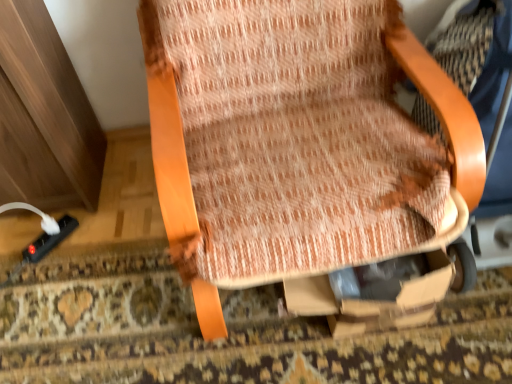
Question: From a real-world perspective, is black plastic plug at lower left positioned over textured fabric chair at center based on gravity?

Choices:
 (A) yes
 (B) no

Answer: (B)

Question: Considering the relative sizes of black plastic plug at lower left and textured fabric chair at center in the image provided, is black plastic plug at lower left thinner than textured fabric chair at center?

Choices:
 (A) yes
 (B) no

Answer: (A)

Question: Is black plastic plug at lower left to the left of textured fabric chair at center from the viewer's perspective?

Choices:
 (A) no
 (B) yes

Answer: (B)

Question: Is black plastic plug at lower left turned away from textured fabric chair at center?

Choices:
 (A) no
 (B) yes

Answer: (A)

Question: Can you confirm if black plastic plug at lower left is wider than textured fabric chair at center?

Choices:
 (A) yes
 (B) no

Answer: (B)

Question: From the image's perspective, is black plastic plug at lower left located beneath textured fabric chair at center?

Choices:
 (A) yes
 (B) no

Answer: (A)

Question: Considering the relative sizes of textured fabric chair at center and black plastic plug at lower left in the image provided, is textured fabric chair at center thinner than black plastic plug at lower left?

Choices:
 (A) no
 (B) yes

Answer: (A)

Question: From a real-world perspective, is textured fabric chair at center physically above black plastic plug at lower left?

Choices:
 (A) yes
 (B) no

Answer: (A)

Question: Considering the relative positions of textured fabric chair at center and black plastic plug at lower left in the image provided, is textured fabric chair at center to the right of black plastic plug at lower left from the viewer's perspective?

Choices:
 (A) no
 (B) yes

Answer: (B)

Question: Considering the relative sizes of textured fabric chair at center and black plastic plug at lower left in the image provided, is textured fabric chair at center shorter than black plastic plug at lower left?

Choices:
 (A) no
 (B) yes

Answer: (A)

Question: From a real-world perspective, is textured fabric chair at center below black plastic plug at lower left?

Choices:
 (A) no
 (B) yes

Answer: (A)

Question: From the image's perspective, does textured fabric chair at center appear higher than black plastic plug at lower left?

Choices:
 (A) no
 (B) yes

Answer: (B)

Question: Would you say black plastic plug at lower left is to the left or to the right of textured fabric chair at center in the picture?

Choices:
 (A) left
 (B) right

Answer: (A)